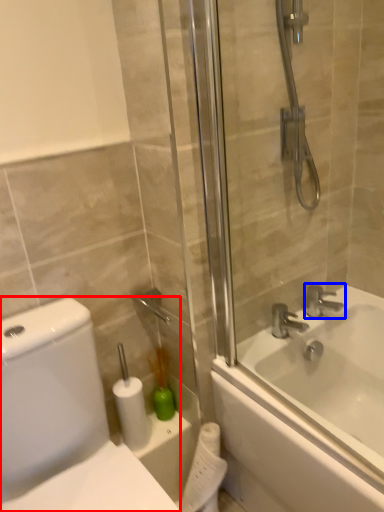
Question: Which object is further to the camera taking this photo, porcelain (highlighted by a red box) or tap (highlighted by a blue box)?

Choices:
 (A) porcelain
 (B) tap

Answer: (B)